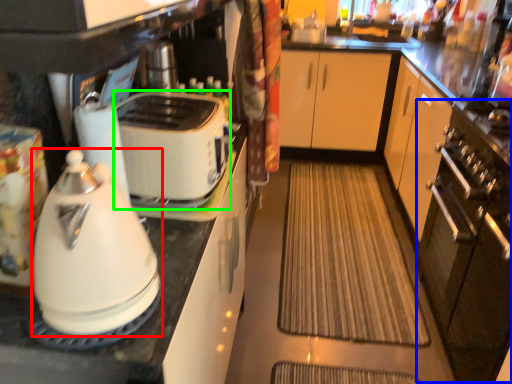
Question: Which object is positioned farthest from kitchen appliance (highlighted by a red box)? Select from oven (highlighted by a blue box) and toaster (highlighted by a green box).

Choices:
 (A) oven
 (B) toaster

Answer: (A)